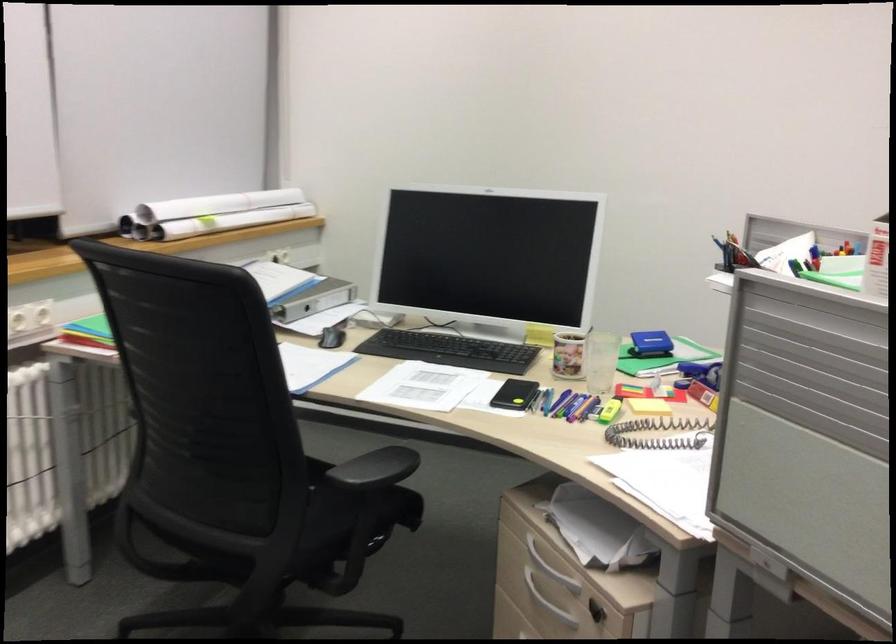
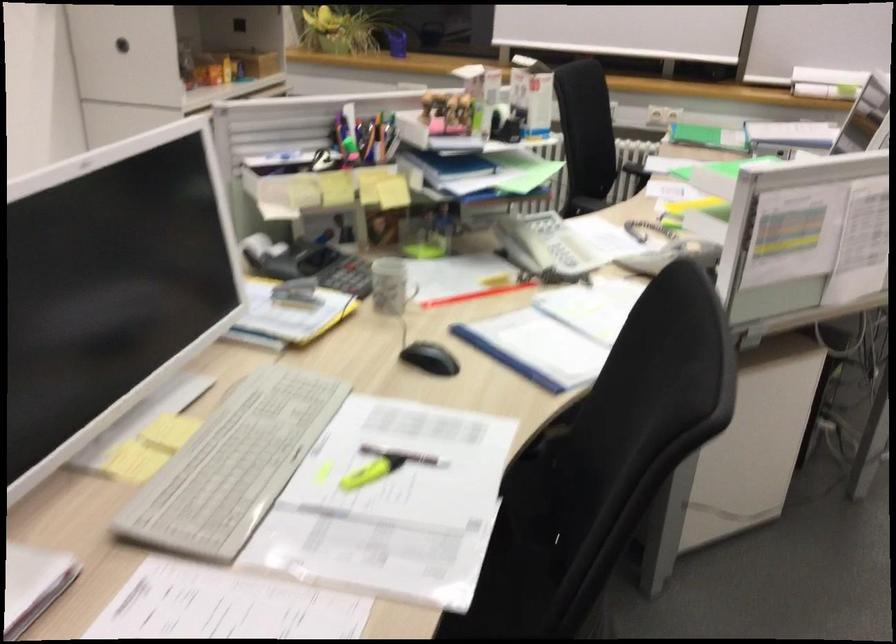
Question: I am providing you with two images of the same scene from different viewpoints. After the viewpoint changes to image2, which objects are now occluded?

Choices:
 (A) black chair sitting surface
 (B) patterned mug
 (C) round cabinet handle
 (D) wrapped picture frame

Answer: (B)